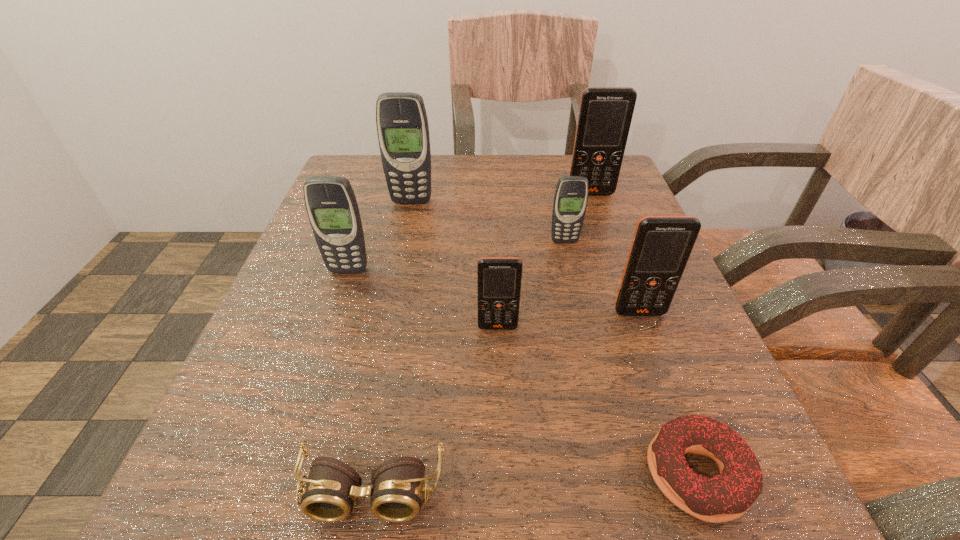
The width and height of the screenshot is (960, 540). I want to click on object present at the near right corner, so click(x=726, y=496).

Locate an element on the screen. The image size is (960, 540). vacant space at the far edge of the desktop is located at coordinates coord(522,204).

I want to click on vacant area at the left edge of the desktop, so click(x=300, y=291).

At what (x,y) coordinates should I click in order to perform the action: click on vacant space at the right edge of the desktop. Please return your answer as a coordinate pair (x, y). The height and width of the screenshot is (540, 960). Looking at the image, I should click on (678, 373).

The width and height of the screenshot is (960, 540). I want to click on vacant space at the near left corner of the desktop, so click(294, 461).

I want to click on vacant space at the far right corner of the desktop, so click(x=619, y=184).

Image resolution: width=960 pixels, height=540 pixels. In order to click on vacant area that lies between the second nearest orange cellular telephone and the second shortest object in this screenshot , I will do `click(506, 402)`.

Identify the location of unoccupied position between the second nearest cellular telephone and the leftmost orange cellular telephone. (568, 320).

Locate an element on the screen. free spot between the smallest orange cellular telephone and the goggles is located at coordinates (435, 409).

Find the location of `free space between the biggest orange cellular telephone and the fourth farthest object`. free space between the biggest orange cellular telephone and the fourth farthest object is located at coordinates click(469, 232).